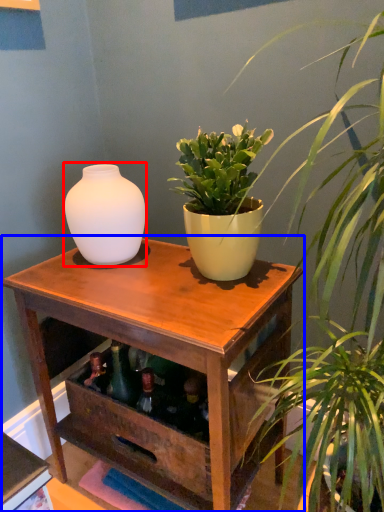
Question: Which object is further to the camera taking this photo, vase (highlighted by a red box) or table (highlighted by a blue box)?

Choices:
 (A) vase
 (B) table

Answer: (A)